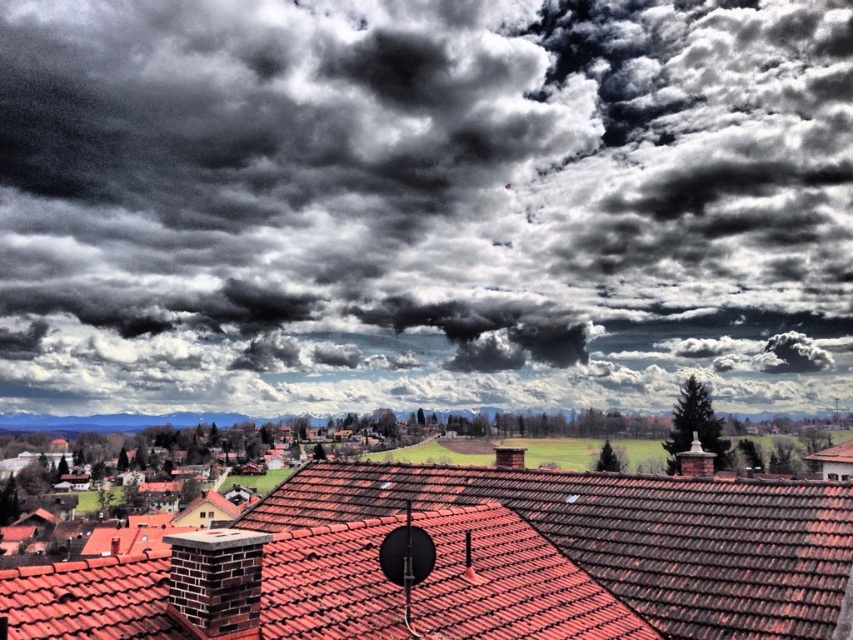
You are an architect designing a new building that needs to withstand heavy rain. You observe the dark gray cloud at upper center and the red clay tiles at center in the image. Which object indicates the potential for heavy rainfall, and why?

The dark gray cloud at upper center indicates the potential for heavy rainfall because it has a larger size compared to the red clay tiles at center, suggesting it contains more moisture and could produce significant precipitation.

You are an architect designing a new building in this area. You need to ensure that the roof can withstand heavy rain from the dark gray cloud at upper center. Since the roof uses red clay tiles at center, how does the size of the cloud compare to the roof tiles in terms of width?

The dark gray cloud at upper center has a greater width than the red clay tiles at center, so the roof tiles are narrower than the cloud. This means the cloud is wider, potentially indicating a larger area of rainfall that the roof must handle.

You are standing on the ground looking at the dark gray cloud at upper center and the red clay tiles at center. If you want to throw a ball to hit both objects, which one should you aim for first and why?

You should aim for the red clay tiles at center first because the dark gray cloud at upper center is farther away from you than the red clay tiles at center by 150.72 meters.